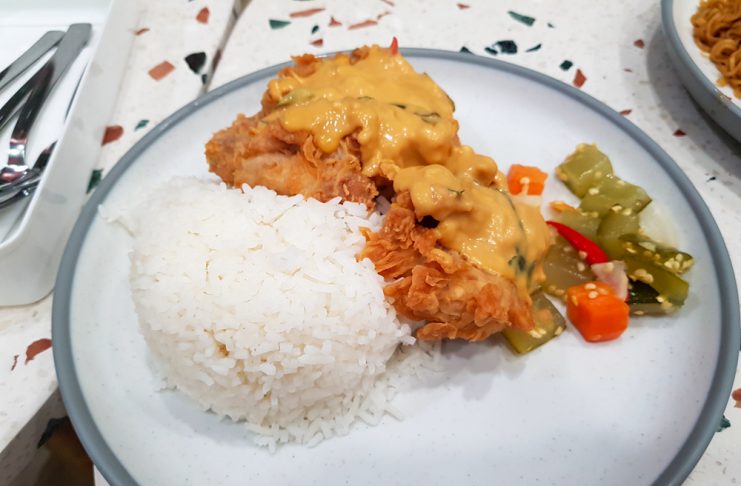
The image size is (741, 486). What are the coordinates of `tablecloth with green and red patterns` in the screenshot? It's located at (153, 97), (602, 39).